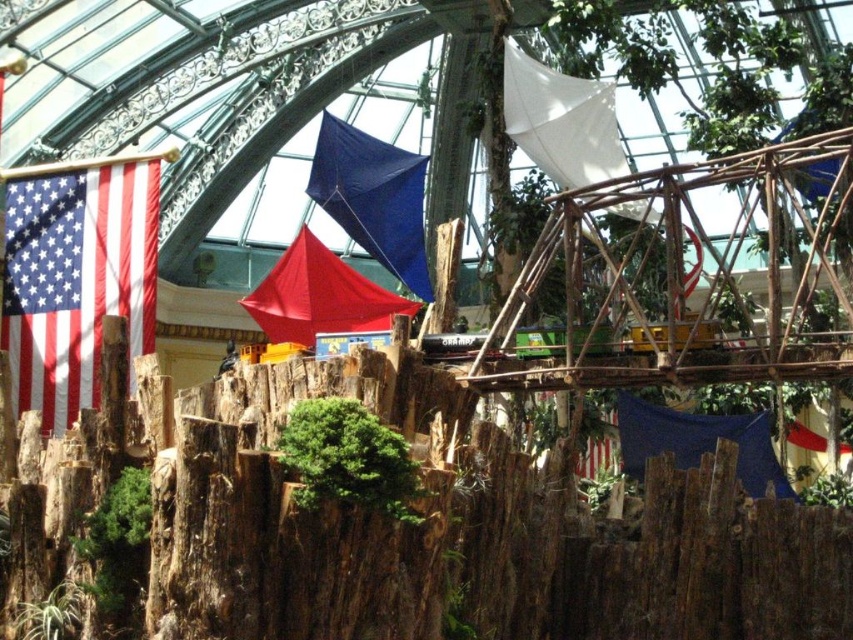
Question: Can you confirm if white fabric flag at upper center is wider than blue fabric flag at upper center?

Choices:
 (A) yes
 (B) no

Answer: (B)

Question: Considering the real-world distances, which object is closest to the blue fabric flag at upper center?

Choices:
 (A) matte red tent at center
 (B) blue fabric kite at center
 (C) matte fabric flag at left
 (D) white fabric flag at upper center

Answer: (D)

Question: Estimate the real-world distances between objects in this image. Which object is farther from the blue fabric kite at center?

Choices:
 (A) white fabric flag at upper center
 (B) matte fabric flag at left
 (C) blue fabric flag at upper center

Answer: (C)

Question: Does white fabric flag at upper center appear under matte red tent at center?

Choices:
 (A) no
 (B) yes

Answer: (A)

Question: Which object is closer to the camera taking this photo?

Choices:
 (A) matte fabric flag at left
 (B) blue fabric flag at upper center

Answer: (A)

Question: Can you confirm if matte fabric flag at left is positioned above white fabric flag at upper center?

Choices:
 (A) no
 (B) yes

Answer: (A)